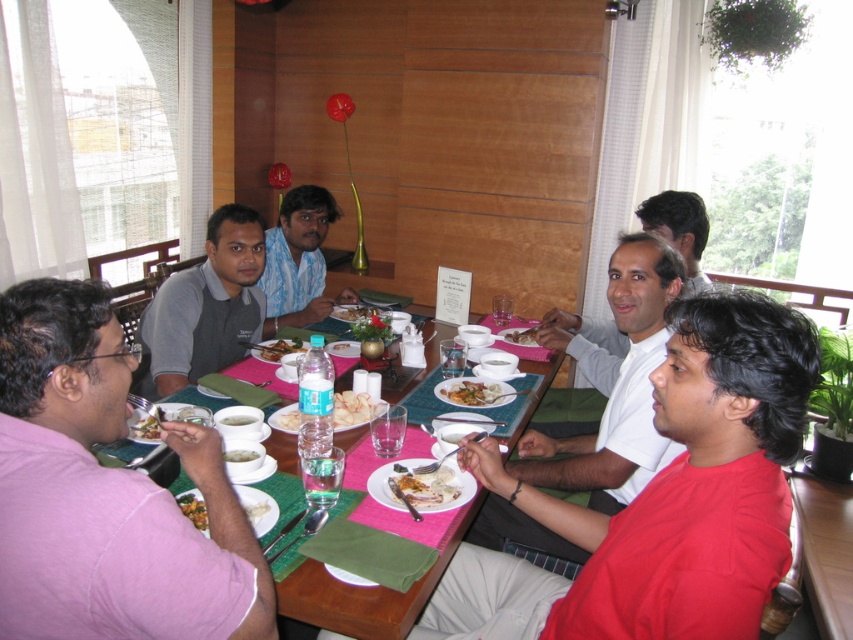
Question: Estimate the real-world distances between objects in this image. Which object is closer to the red matte shirt at lower right?

Choices:
 (A) white matte plate at center
 (B) golden fried snack at center
 (C) translucent plastic bottle at center
 (D) golden fried snacks at center

Answer: (D)

Question: Which point is closer to the camera?

Choices:
 (A) (323, 188)
 (B) (485, 385)
 (C) (202, 310)

Answer: (B)

Question: Is slightly yellowish matte plate at center below white matte plate at center?

Choices:
 (A) yes
 (B) no

Answer: (B)

Question: Can you confirm if white matte shirt at center is bigger than slightly yellowish matte plate at center?

Choices:
 (A) yes
 (B) no

Answer: (A)

Question: Among these points, which one is farthest from the camera?

Choices:
 (A) (320, 294)
 (B) (212, 250)
 (C) (294, 342)

Answer: (A)

Question: Can you confirm if white creamy rice at center is positioned to the right of white matte plate at center?

Choices:
 (A) yes
 (B) no

Answer: (A)